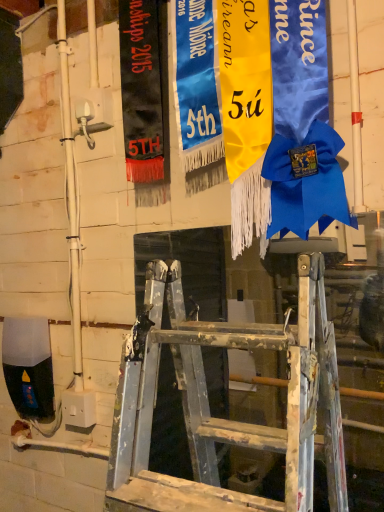
Question: Visually, is blue satin ribbon at upper center, marked as the 2th tapestry in a right-to-left arrangement, positioned to the left or to the right of yellow satin ribbon at center, which ranks as the first tapestry in right-to-left order?

Choices:
 (A) right
 (B) left

Answer: (B)

Question: From the image's perspective, is blue satin ribbon at upper center, marked as the second tapestry in a left-to-right arrangement, located above or below yellow satin ribbon at center, which ranks as the first tapestry in right-to-left order?

Choices:
 (A) below
 (B) above

Answer: (B)

Question: Which of these objects is positioned closest to the yellow satin ribbon at center, marked as the third tapestry in a left-to-right arrangement?

Choices:
 (A) black fabric banner at upper left, marked as the 1th tapestry in a left-to-right arrangement
 (B) blue satin ribbon at upper center, marked as the second tapestry in a left-to-right arrangement

Answer: (B)

Question: Estimate the real-world distances between objects in this image. Which object is farther from the blue satin ribbon at upper center, marked as the 2th tapestry in a right-to-left arrangement?

Choices:
 (A) yellow satin ribbon at center, marked as the third tapestry in a left-to-right arrangement
 (B) black fabric banner at upper left, marked as the 1th tapestry in a left-to-right arrangement

Answer: (B)